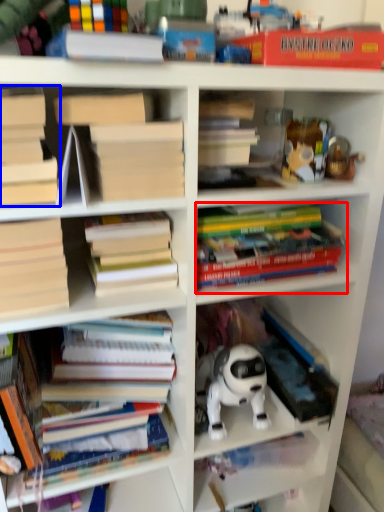
Question: Which of the following is the farthest to the observer, book (highlighted by a red box) or book (highlighted by a blue box)?

Choices:
 (A) book
 (B) book

Answer: (A)